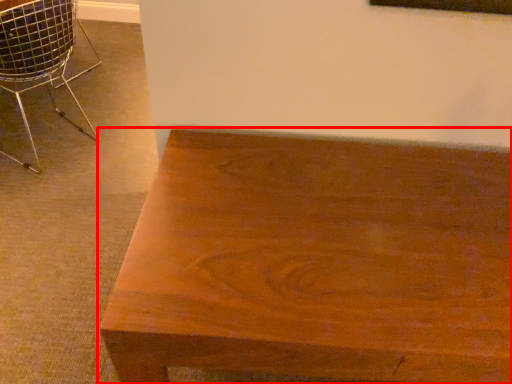
Question: From the image's perspective, what is the correct spatial positioning of table (annotated by the red box) in reference to chair?

Choices:
 (A) above
 (B) below

Answer: (B)